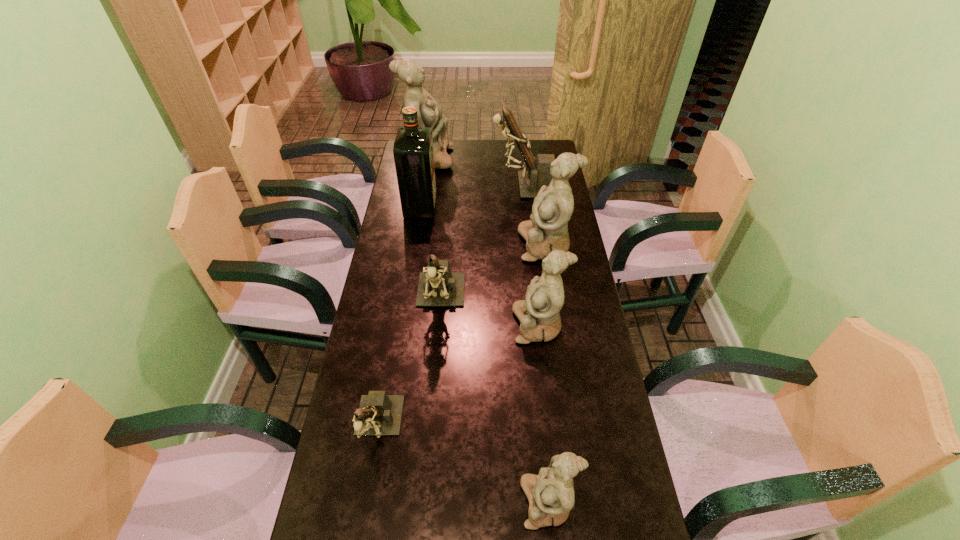
The height and width of the screenshot is (540, 960). Identify the location of the nearest figurine. (551, 496).

Find the location of a particular element. Image resolution: width=960 pixels, height=540 pixels. the sixth farthest figurine is located at coordinates (379, 414).

Where is `the seventh farthest object`? Image resolution: width=960 pixels, height=540 pixels. the seventh farthest object is located at coordinates (379, 414).

Locate an element on the screen. vacant space positioned on the front-facing side of the leftmost white figurine is located at coordinates (503, 158).

I want to click on vacant space located on the front label of the liquor, so click(526, 206).

In order to click on free space located 0.110m on the front-facing side of the fifth nearest object in this screenshot , I will do `click(489, 245)`.

Where is `vacant space situated on the front-facing side of the fifth nearest object`? vacant space situated on the front-facing side of the fifth nearest object is located at coordinates (457, 245).

Where is `vacant space located 0.050m on the front-facing side of the fifth nearest object`? This screenshot has width=960, height=540. vacant space located 0.050m on the front-facing side of the fifth nearest object is located at coordinates (505, 245).

I want to click on vacant point located 0.140m on the front-facing side of the farthest brown figurine, so click(459, 185).

This screenshot has width=960, height=540. Find the location of `free space located on the front-facing side of the farthest brown figurine`. free space located on the front-facing side of the farthest brown figurine is located at coordinates (477, 185).